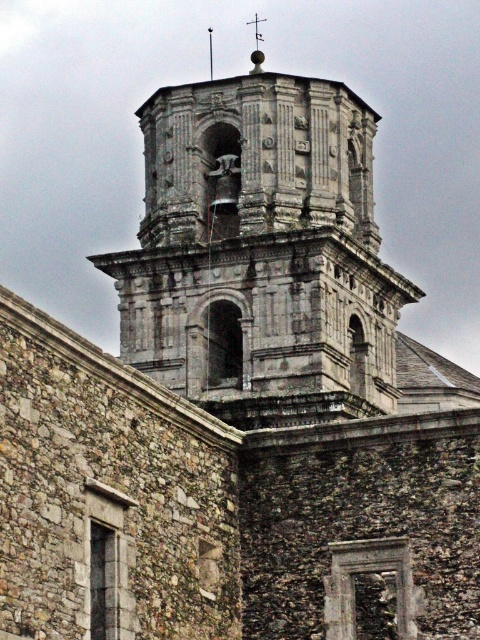
You are standing in front of the historic stone building and looking at two points marked on the structure. Which point, point (x=269, y=193) or point (x=261, y=38), is closer to you?

Point (x=269, y=193) is closer to you because it is in front of point (x=261, y=38).

You are an architect assessing the structural integrity of the stone bell tower at center and the polished silver spire at upper center. Based on their heights, which one might require additional support to prevent toppling?

The stone bell tower at center has a lesser height compared to polished silver spire at upper center, so the stone bell tower at center might require additional support to prevent toppling since it is shorter and potentially less stable.

You are standing in front of the historic stone building and want to locate both the stone bell tower at center and the polished silver spire at upper center. Based on their positions, which one is positioned to the right side of the other?

The stone bell tower at center is to the right of polished silver spire at upper center.